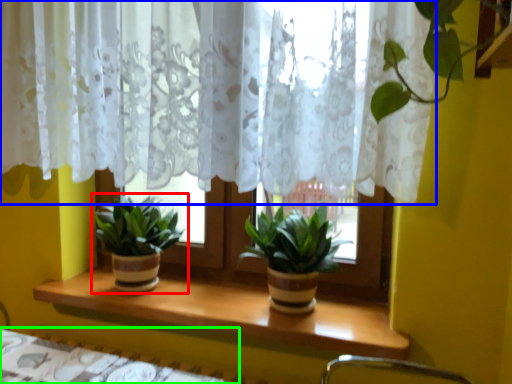
Question: Considering the real-world distances, which object is closest to houseplant (highlighted by a red box)? curtain (highlighted by a blue box) or table (highlighted by a green box).

Choices:
 (A) curtain
 (B) table

Answer: (B)